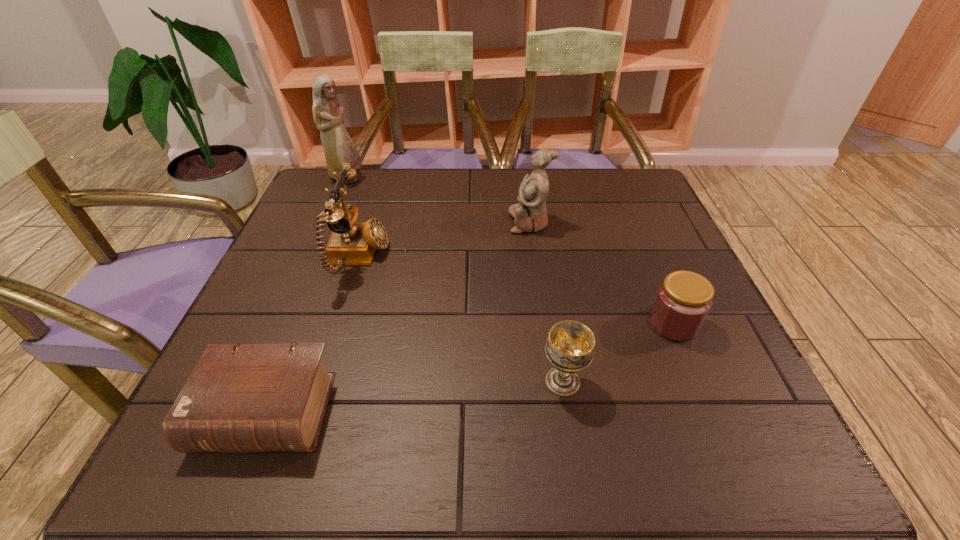
This screenshot has height=540, width=960. Find the location of `vacant area between the chalice and the jam`. vacant area between the chalice and the jam is located at coordinates (617, 353).

The image size is (960, 540). What are the coordinates of `vacant point located between the right figurine and the shortest object` in the screenshot? It's located at (397, 318).

Identify the location of vacant area between the chalice and the rightmost object. (617, 353).

Identify the location of empty space between the chalice and the left figurine. Image resolution: width=960 pixels, height=540 pixels. (454, 280).

You are a GUI agent. You are given a task and a screenshot of the screen. Output one action in this format:
    pyautogui.click(x=<x>, y=<y>)
    Task: Click on the empty location between the chalice and the Bible
    The image size is (960, 540).
    Given the screenshot: What is the action you would take?
    pyautogui.click(x=415, y=397)

Image resolution: width=960 pixels, height=540 pixels. In order to click on free point between the chalice and the shorter figurine in this screenshot , I will do `click(546, 302)`.

Find the location of a particular element. free point between the nearer figurine and the Bible is located at coordinates 397,318.

The height and width of the screenshot is (540, 960). Identify the location of free spot between the shorter figurine and the farther figurine. (438, 200).

Select which object appears as the closest to the chalice. Please provide its 2D coordinates. Your answer should be formatted as a tuple, i.e. [(x, y)], where the tuple contains the x and y coordinates of a point satisfying the conditions above.

[(683, 300)]

Select which object appears as the fifth closest to the Bible. Please provide its 2D coordinates. Your answer should be formatted as a tuple, i.e. [(x, y)], where the tuple contains the x and y coordinates of a point satisfying the conditions above.

[(339, 148)]